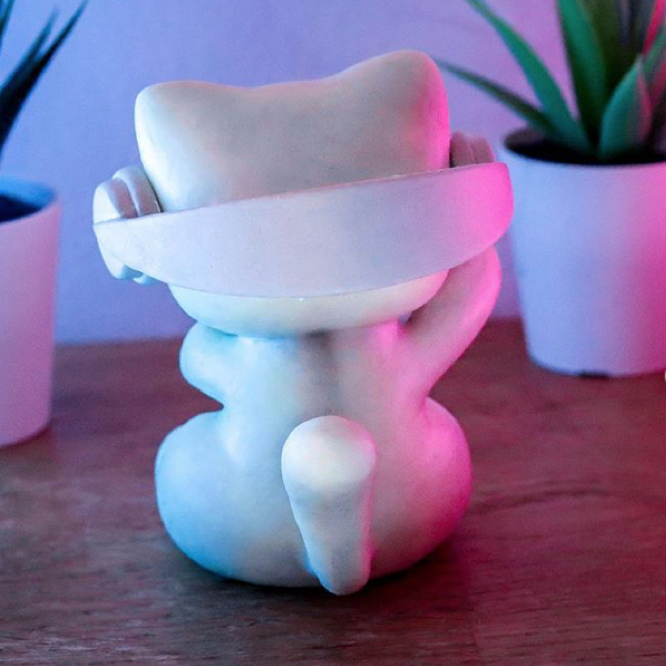
Locate an element on the screen. Image resolution: width=666 pixels, height=666 pixels. table is located at coordinates (525, 585).